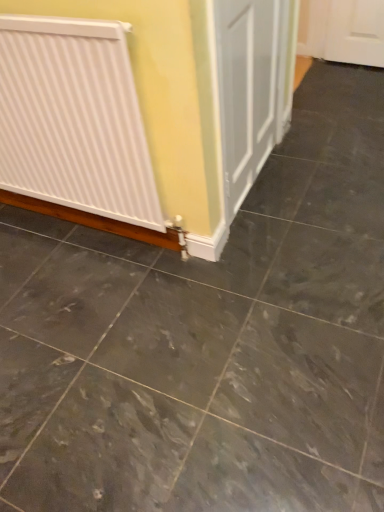
Question: From a real-world perspective, is gray marble floor at center physically located above or below white ribbed radiator at left?

Choices:
 (A) below
 (B) above

Answer: (A)

Question: From their relative heights in the image, would you say gray marble floor at center is taller or shorter than white ribbed radiator at left?

Choices:
 (A) short
 (B) tall

Answer: (A)

Question: In terms of size, does gray marble floor at center appear bigger or smaller than white ribbed radiator at left?

Choices:
 (A) small
 (B) big

Answer: (A)

Question: From the image's perspective, relative to gray marble floor at center, is white ribbed radiator at left above or below?

Choices:
 (A) below
 (B) above

Answer: (B)

Question: In terms of height, does white ribbed radiator at left look taller or shorter compared to gray marble floor at center?

Choices:
 (A) tall
 (B) short

Answer: (A)

Question: From a real-world perspective, is white ribbed radiator at left physically located above or below gray marble floor at center?

Choices:
 (A) above
 (B) below

Answer: (A)

Question: Is white ribbed radiator at left wider or thinner than gray marble floor at center?

Choices:
 (A) wide
 (B) thin

Answer: (B)